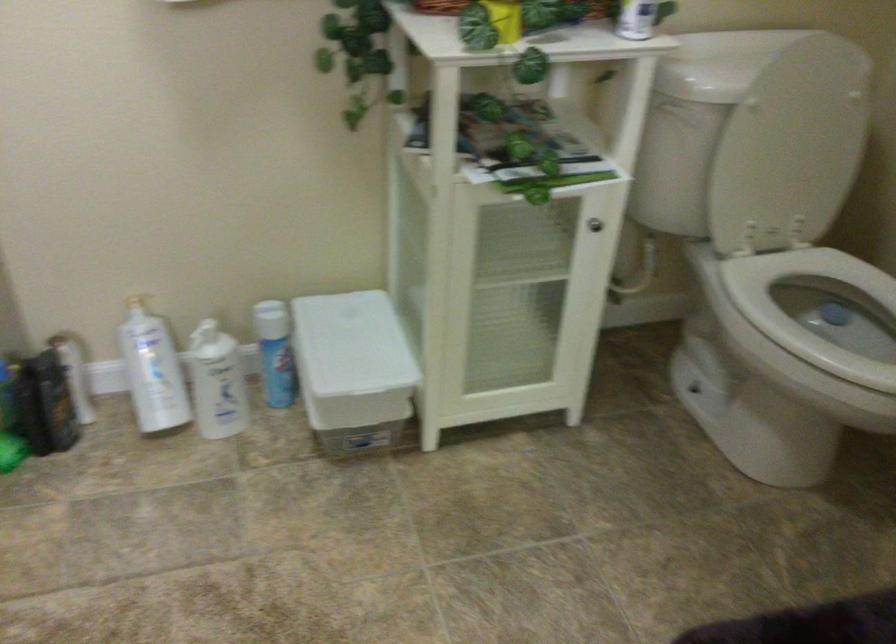
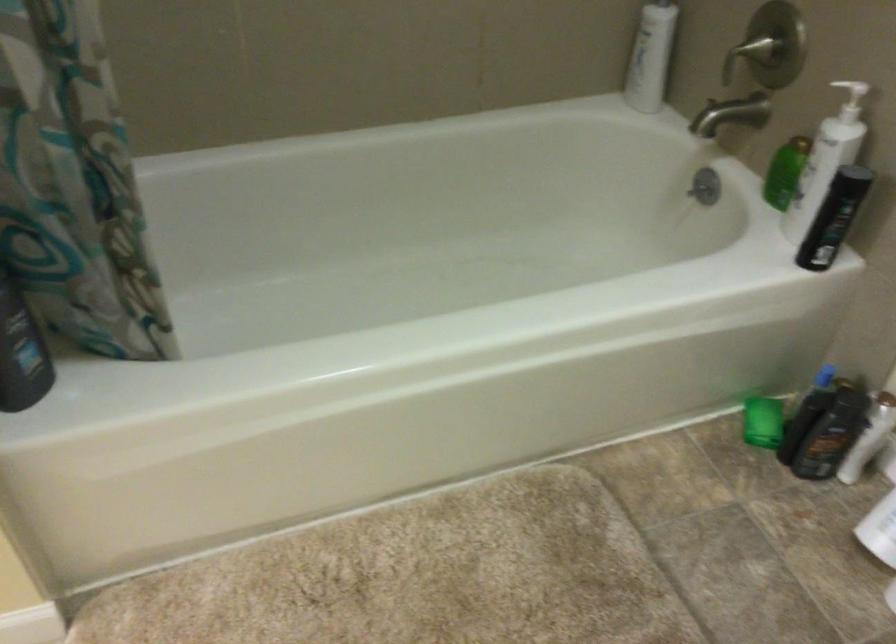
The first image is from the beginning of the video and the second image is from the end. How did the camera likely rotate when shooting the video?

The camera's rotation is toward left-down.